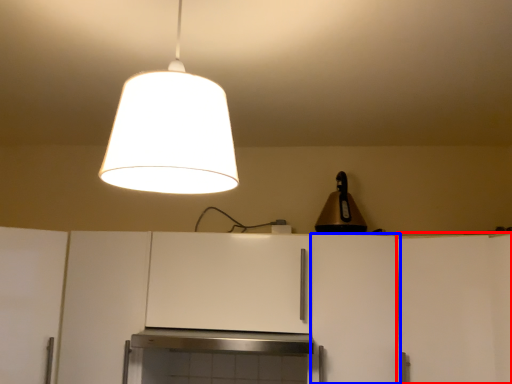
Question: Which point is closer to the camera, cabinetry (highlighted by a red box) or cabinetry (highlighted by a blue box)?

Choices:
 (A) cabinetry
 (B) cabinetry

Answer: (A)